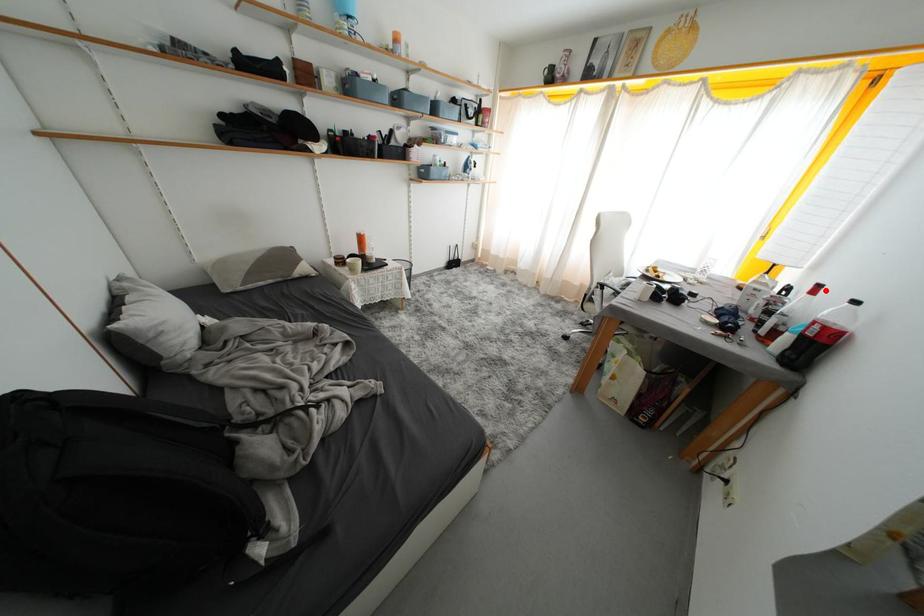
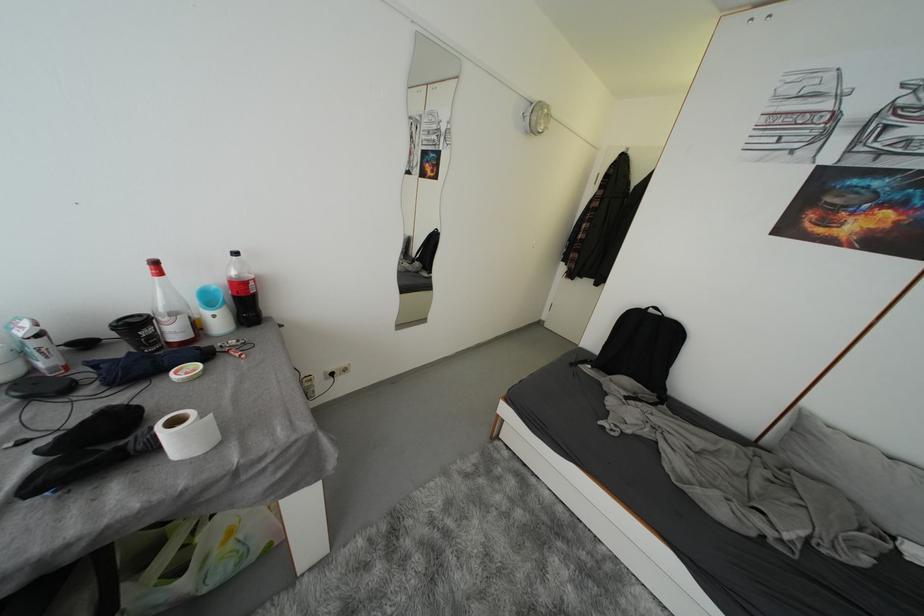
Where in the second image is the point corresponding to the highlighted location from the first image?

(162, 267)